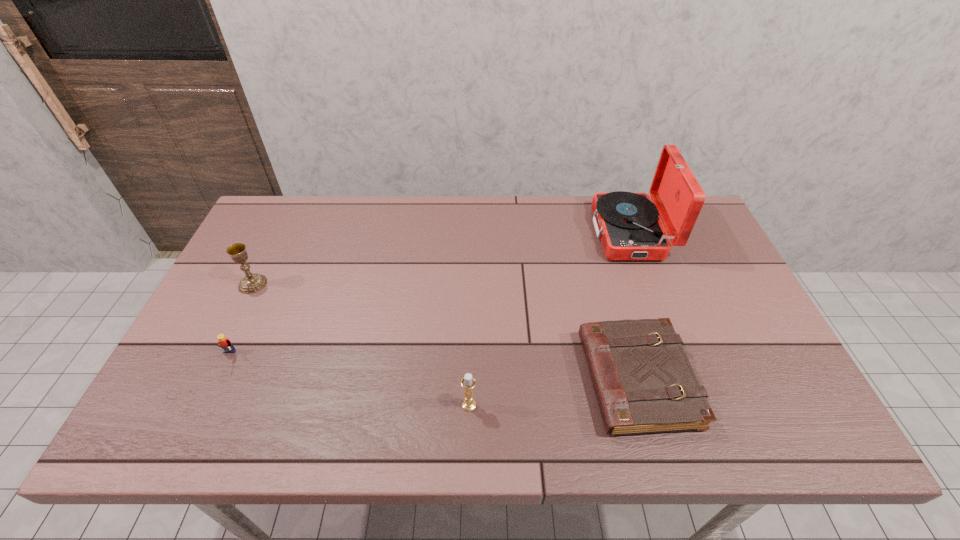
Find the location of a particular element. phonograph_record is located at coordinates (629, 227).

Identify the location of the tallest object. (629, 227).

The image size is (960, 540). Find the location of `chalice`. chalice is located at coordinates (251, 283).

What are the coordinates of `candle holder` in the screenshot? It's located at (468, 382).

I want to click on Lego, so click(x=224, y=343).

This screenshot has width=960, height=540. Find the location of `the shortest object`. the shortest object is located at coordinates (643, 380).

You are a GUI agent. You are given a task and a screenshot of the screen. Output one action in this format:
    pyautogui.click(x=<x>, y=<y>)
    Task: Click on the free space located on the front-facing side of the tallest object
    Image resolution: width=960 pixels, height=540 pixels.
    Given the screenshot: What is the action you would take?
    [488, 233]

I want to click on vacant space situated 0.170m on the front-facing side of the tallest object, so click(540, 233).

Where is `free location located on the front-facing side of the tallest object`? The width and height of the screenshot is (960, 540). free location located on the front-facing side of the tallest object is located at coordinates (540, 233).

This screenshot has height=540, width=960. I want to click on vacant space located on the back of the fourth nearest object, so click(x=279, y=230).